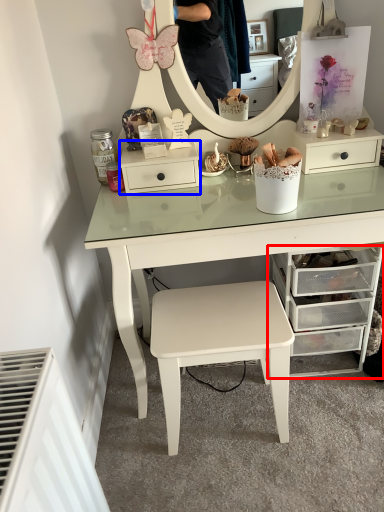
Question: Which object appears farthest to the camera in this image, chest of drawers (highlighted by a red box) or nightstand (highlighted by a blue box)?

Choices:
 (A) chest of drawers
 (B) nightstand

Answer: (B)